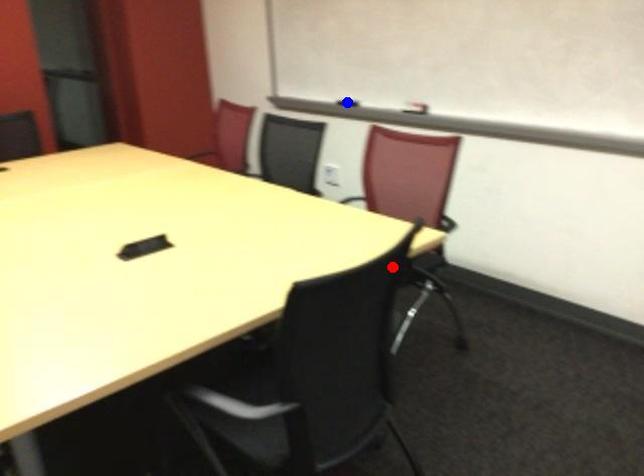
Question: Which of the two points in the image is closer to the camera?

Choices:
 (A) Blue point is closer.
 (B) Red point is closer.

Answer: (B)